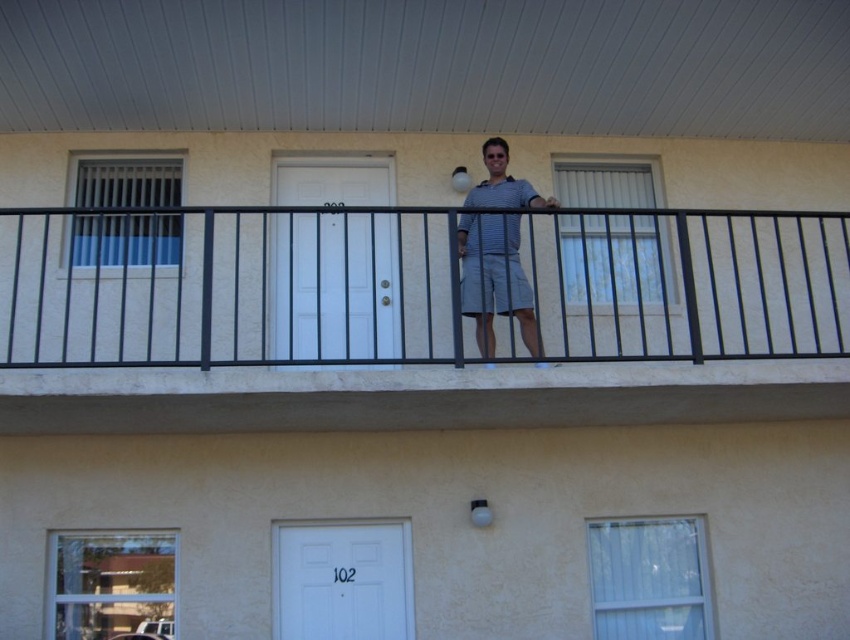
You are standing on a balcony and want to check if you can safely reach the striped fabric shorts at center without overreaching. Your maximum reach distance is 5 meters. Can you safely reach it?

The striped fabric shorts at center and viewer are 5.53 meters apart, which exceeds your maximum reach distance of 5 meters. Therefore, you cannot safely reach the striped fabric shorts at center without overreaching.

You are a delivery person trying to reach apartment 102. You see two points marked on the building exterior. The first point is at coordinates point (474, 250), and the second is at point (510, 240). Which point is closer to the door labeled 102?

Point (510, 240) is closer to the door labeled 102 because it is in front of point (474, 250), which is behind it.